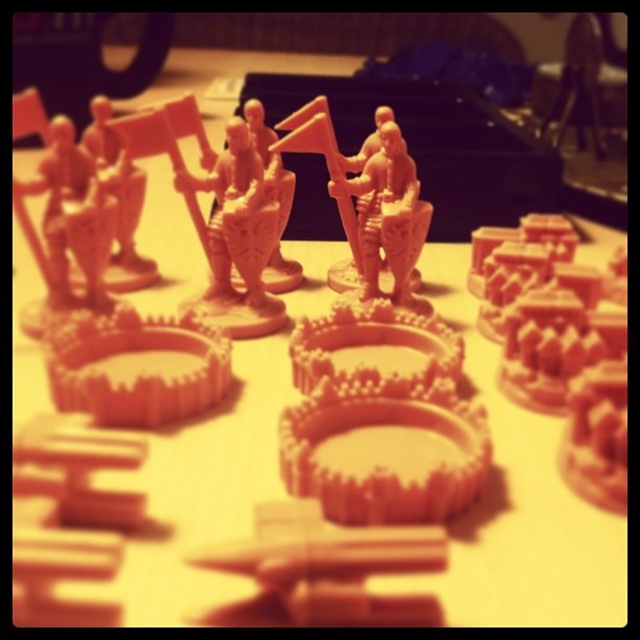
Question: Does matte plastic gear at center come behind matte orange gear at center?

Choices:
 (A) no
 (B) yes

Answer: (A)

Question: Estimate the real-world distances between objects in this image. Which object is farther from the matte orange figurine at center?

Choices:
 (A) matte orange gear at center
 (B) matte plastic gear at center

Answer: (B)

Question: Observing the image, what is the correct spatial positioning of matte plastic gear at center in reference to matte orange gear at center?

Choices:
 (A) right
 (B) left

Answer: (A)

Question: Which point appears farthest from the camera in this image?

Choices:
 (A) (392, 198)
 (B) (257, 550)

Answer: (A)

Question: Which of these objects is positioned closest to the matte plastic gear at center?

Choices:
 (A) matte orange gear at center
 (B) matte orange figurine at center

Answer: (A)

Question: Can you confirm if matte plastic gear at center is positioned to the right of matte orange figurine at center?

Choices:
 (A) no
 (B) yes

Answer: (A)